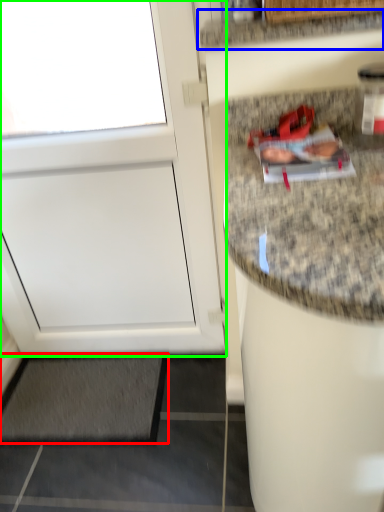
Question: Estimate the real-world distances between objects in this image. Which object is closer to mat (highlighted by a red box), countertop (highlighted by a blue box) or door (highlighted by a green box)?

Choices:
 (A) countertop
 (B) door

Answer: (B)